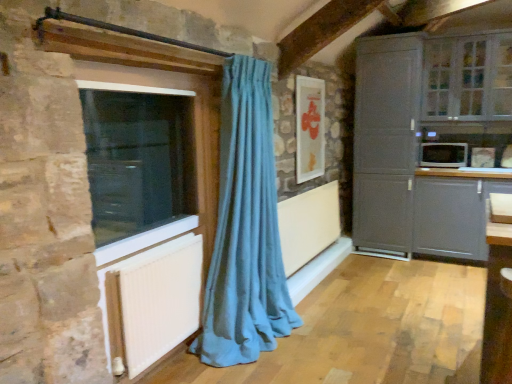
You are a GUI agent. You are given a task and a screenshot of the screen. Output one action in this format:
    pyautogui.click(x=<x>, y=<y>)
    Task: Click on the vacant region above transparent glass window at left, which is the 1th window from bottom to top (from a real-world perspective)
    The width and height of the screenshot is (512, 384).
    Given the screenshot: What is the action you would take?
    pyautogui.click(x=141, y=86)